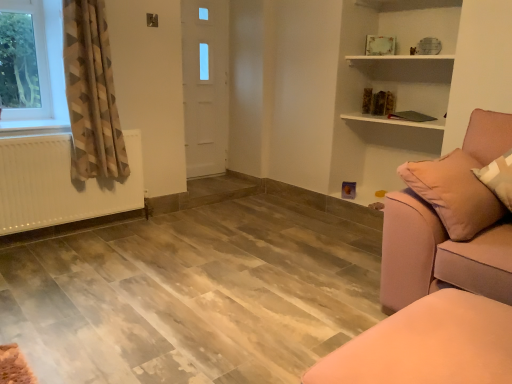
Question: Is satin pink couch at right located outside white matte radiator at left?

Choices:
 (A) yes
 (B) no

Answer: (A)

Question: Can you confirm if satin pink couch at right is bigger than white matte radiator at left?

Choices:
 (A) yes
 (B) no

Answer: (A)

Question: From the image's perspective, would you say satin pink couch at right is positioned over white matte radiator at left?

Choices:
 (A) no
 (B) yes

Answer: (A)

Question: Is satin pink couch at right not close to white matte radiator at left?

Choices:
 (A) yes
 (B) no

Answer: (A)

Question: Is satin pink couch at right touching white matte radiator at left?

Choices:
 (A) yes
 (B) no

Answer: (B)

Question: Can you confirm if satin pink couch at right is smaller than white matte radiator at left?

Choices:
 (A) no
 (B) yes

Answer: (A)

Question: Does pink fabric ottoman at lower right have a larger size compared to white matte radiator at left?

Choices:
 (A) yes
 (B) no

Answer: (A)

Question: Is pink fabric ottoman at lower right facing away from white matte radiator at left?

Choices:
 (A) yes
 (B) no

Answer: (B)

Question: Is pink fabric ottoman at lower right touching white matte radiator at left?

Choices:
 (A) yes
 (B) no

Answer: (B)

Question: Is pink fabric ottoman at lower right located outside white matte radiator at left?

Choices:
 (A) yes
 (B) no

Answer: (A)

Question: Does pink fabric ottoman at lower right have a greater height compared to white matte radiator at left?

Choices:
 (A) yes
 (B) no

Answer: (B)

Question: Does pink fabric ottoman at lower right have a lesser height compared to white matte radiator at left?

Choices:
 (A) yes
 (B) no

Answer: (A)

Question: Considering the relative positions of geometric-patterned fabric curtain at left and white matte radiator at left in the image provided, is geometric-patterned fabric curtain at left to the left of white matte radiator at left from the viewer's perspective?

Choices:
 (A) no
 (B) yes

Answer: (A)